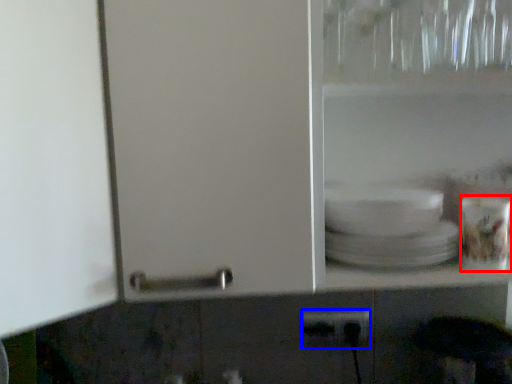
Question: Which object appears closest to the camera in this image, tableware (highlighted by a red box) or power plugs and sockets (highlighted by a blue box)?

Choices:
 (A) tableware
 (B) power plugs and sockets

Answer: (A)